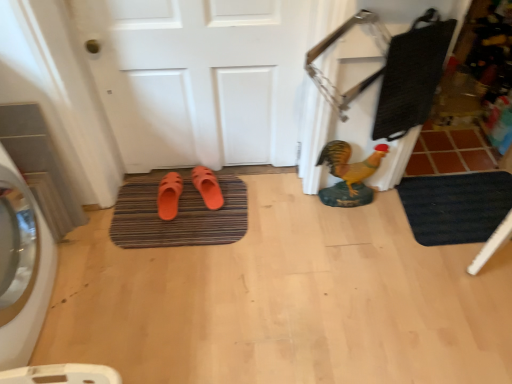
This screenshot has height=384, width=512. Describe the element at coordinates (450, 152) in the screenshot. I see `brown tile at right` at that location.

Looking at this image, measure the distance between point (144, 196) and camera.

They are 1.96 meters apart.

The width and height of the screenshot is (512, 384). What do you see at coordinates (207, 187) in the screenshot? I see `orange rubber slipper at center, marked as the 2th footwear in a left-to-right arrangement` at bounding box center [207, 187].

The height and width of the screenshot is (384, 512). What do you see at coordinates (33, 287) in the screenshot?
I see `white glossy washing machine at left` at bounding box center [33, 287].

What is the approximate width of white matte door at center?

10.76 centimeters.

In order to click on yellow matte chicken at center-right in this screenshot , I will do `click(350, 164)`.

Does point (356, 167) come farther from viewer compared to point (416, 144)?

No, (356, 167) is closer to viewer.

In terms of size, does yellow matte chicken at center-right appear bigger or smaller than brown tile at right?

Clearly, yellow matte chicken at center-right is smaller in size than brown tile at right.

Can you confirm if yellow matte chicken at center-right is thinner than brown tile at right?

Yes, yellow matte chicken at center-right is thinner than brown tile at right.

Could you tell me if yellow matte chicken at center-right is turned towards brown tile at right?

No, yellow matte chicken at center-right is not oriented towards brown tile at right.

Is orange rubber slipper at center, placed as the 1th footwear when sorted from right to left, not close to white glossy washing machine at left?

No, there isn't a large distance between orange rubber slipper at center, placed as the 1th footwear when sorted from right to left, and white glossy washing machine at left.

Which is more to the right, orange rubber slipper at center, marked as the 2th footwear in a left-to-right arrangement, or white glossy washing machine at left?

orange rubber slipper at center, marked as the 2th footwear in a left-to-right arrangement, is more to the right.

Does orange rubber slipper at center, placed as the 1th footwear when sorted from right to left, have a smaller size compared to white glossy washing machine at left?

Yes, orange rubber slipper at center, placed as the 1th footwear when sorted from right to left, is smaller than white glossy washing machine at left.

Based on the photo, between orange rubber slipper at center, marked as the 2th footwear in a left-to-right arrangement, and white glossy washing machine at left, which one has more height?

With more height is white glossy washing machine at left.

Find the location of a particular element. This screenshot has height=384, width=512. chicken above the orange rubber slipper at center, marked as the 2th footwear in a left-to-right arrangement (from a real-world perspective) is located at coordinates (350, 164).

Between yellow matte chicken at center-right and orange rubber slipper at center, placed as the 1th footwear when sorted from right to left, which one has larger size?

Bigger between the two is yellow matte chicken at center-right.

Is yellow matte chicken at center-right not within orange rubber slipper at center, marked as the 2th footwear in a left-to-right arrangement?

Yes, yellow matte chicken at center-right is outside of orange rubber slipper at center, marked as the 2th footwear in a left-to-right arrangement.

Considering the sizes of objects yellow matte chicken at center-right and orange rubber slipper at center, marked as the 2th footwear in a left-to-right arrangement, in the image provided, who is thinner, yellow matte chicken at center-right or orange rubber slipper at center, marked as the 2th footwear in a left-to-right arrangement,?

yellow matte chicken at center-right is thinner.

From a real-world perspective, between white glossy washing machine at left and brown textured bath mat at center, the 2th bath mat from the right, who is vertically lower?

brown textured bath mat at center, the 2th bath mat from the right.

Is white glossy washing machine at left at the left side of brown textured bath mat at center, the 2th bath mat from the right?

Indeed, white glossy washing machine at left is positioned on the left side of brown textured bath mat at center, the 2th bath mat from the right.

Which of these two, white glossy washing machine at left or brown textured bath mat at center, the 2th bath mat from the right, is thinner?

With smaller width is white glossy washing machine at left.

How distant is white glossy washing machine at left from brown textured bath mat at center, marked as the first bath mat in a left-to-right arrangement?

white glossy washing machine at left and brown textured bath mat at center, marked as the first bath mat in a left-to-right arrangement, are 19.78 inches apart from each other.

Is white glossy washing machine at left thinner than black rubber bath mat at lower right, positioned as the first bath mat in right-to-left order?

Correct, the width of white glossy washing machine at left is less than that of black rubber bath mat at lower right, positioned as the first bath mat in right-to-left order.

Considering the sizes of objects white glossy washing machine at left and black rubber bath mat at lower right, which is counted as the second bath mat, starting from the left, in the image provided, who is smaller, white glossy washing machine at left or black rubber bath mat at lower right, which is counted as the second bath mat, starting from the left,?

With smaller size is black rubber bath mat at lower right, which is counted as the second bath mat, starting from the left.

Where is `the 1st bath mat behind the white glossy washing machine at left, counting from the anchor's position`? the 1st bath mat behind the white glossy washing machine at left, counting from the anchor's position is located at coordinates (456, 206).

Visually, is white glossy washing machine at left positioned to the left or to the right of black rubber bath mat at lower right, which is counted as the second bath mat, starting from the left?

white glossy washing machine at left is to the left of black rubber bath mat at lower right, which is counted as the second bath mat, starting from the left.

From a real-world perspective, is orange rubber slipper at center, marked as the 2th footwear in a right-to-left arrangement, located beneath yellow matte chicken at center-right?

Indeed, from a real-world perspective, orange rubber slipper at center, marked as the 2th footwear in a right-to-left arrangement, is positioned beneath yellow matte chicken at center-right.

Which of these two, orange rubber slipper at center, the 1th footwear from the left, or yellow matte chicken at center-right, is thinner?

With smaller width is yellow matte chicken at center-right.

I want to click on chicken that is on the right side of orange rubber slipper at center, the 1th footwear from the left, so click(x=350, y=164).

Are orange rubber slipper at center, marked as the 2th footwear in a right-to-left arrangement, and yellow matte chicken at center-right located far from each other?

No, orange rubber slipper at center, marked as the 2th footwear in a right-to-left arrangement, is in close proximity to yellow matte chicken at center-right.

Considering the sizes of objects black rubber bath mat at lower right, which is counted as the second bath mat, starting from the left, and yellow matte chicken at center-right in the image provided, who is smaller, black rubber bath mat at lower right, which is counted as the second bath mat, starting from the left, or yellow matte chicken at center-right?

Smaller between the two is black rubber bath mat at lower right, which is counted as the second bath mat, starting from the left.

Find the location of a particular element. chicken that appears in front of the black rubber bath mat at lower right, positioned as the first bath mat in right-to-left order is located at coordinates (x=350, y=164).

In terms of width, does black rubber bath mat at lower right, positioned as the first bath mat in right-to-left order, look wider or thinner when compared to yellow matte chicken at center-right?

Considering their sizes, black rubber bath mat at lower right, positioned as the first bath mat in right-to-left order, looks broader than yellow matte chicken at center-right.

From the image's perspective, between black rubber bath mat at lower right, positioned as the first bath mat in right-to-left order, and yellow matte chicken at center-right, who is located below?

black rubber bath mat at lower right, positioned as the first bath mat in right-to-left order, is shown below in the image.

Identify the location of tile on the right side of yellow matte chicken at center-right. (450, 152).

I want to click on washing machine to the left of orange rubber slipper at center, marked as the 2th footwear in a left-to-right arrangement, so click(x=33, y=287).

In the scene shown: Looking at the image, which one is located further to yellow matte chicken at center-right, orange rubber slipper at center, the 1th footwear from the left, or brown textured bath mat at center, the 2th bath mat from the right?

The object further to yellow matte chicken at center-right is orange rubber slipper at center, the 1th footwear from the left.

Considering their positions, is brown textured bath mat at center, the 2th bath mat from the right, positioned closer to white glossy washing machine at left than white matte door at center?

brown textured bath mat at center, the 2th bath mat from the right, is positioned closer to the anchor white glossy washing machine at left.

Which object lies nearer to the anchor point brown tile at right, orange rubber slipper at center, marked as the 2th footwear in a left-to-right arrangement, or yellow matte chicken at center-right?

yellow matte chicken at center-right is closer to brown tile at right.

Based on their spatial positions, is orange rubber slipper at center, placed as the 1th footwear when sorted from right to left, or yellow matte chicken at center-right further from white matte door at center?

yellow matte chicken at center-right lies further to white matte door at center than the other object.

Which object lies further to the anchor point brown tile at right, white matte door at center or orange rubber slipper at center, placed as the 1th footwear when sorted from right to left?

Among the two, orange rubber slipper at center, placed as the 1th footwear when sorted from right to left, is located further to brown tile at right.

Based on their spatial positions, is white matte door at center or brown tile at right closer to brown textured bath mat at center, the 2th bath mat from the right?

Based on the image, white matte door at center appears to be nearer to brown textured bath mat at center, the 2th bath mat from the right.

Considering their positions, is yellow matte chicken at center-right positioned further to white glossy washing machine at left than brown tile at right?

Among the two, brown tile at right is located further to white glossy washing machine at left.

Based on the photo, from the image, which object appears to be nearer to brown textured bath mat at center, the 2th bath mat from the right, white matte door at center or yellow matte chicken at center-right?

white matte door at center lies closer to brown textured bath mat at center, the 2th bath mat from the right, than the other object.

Identify the location of bath mat between orange rubber slipper at center, marked as the 2th footwear in a right-to-left arrangement, and orange rubber slipper at center, marked as the 2th footwear in a left-to-right arrangement. (178, 217).

In order to click on chicken situated between white matte door at center and black rubber bath mat at lower right, positioned as the first bath mat in right-to-left order, from left to right in this screenshot , I will do pyautogui.click(x=350, y=164).

Where is `bath mat located between white matte door at center and brown tile at right in the left-right direction`? bath mat located between white matte door at center and brown tile at right in the left-right direction is located at coordinates (456, 206).

Locate an element on the screen. This screenshot has width=512, height=384. door between white glossy washing machine at left and black rubber bath mat at lower right, which is counted as the second bath mat, starting from the left, in the horizontal direction is located at coordinates (199, 78).